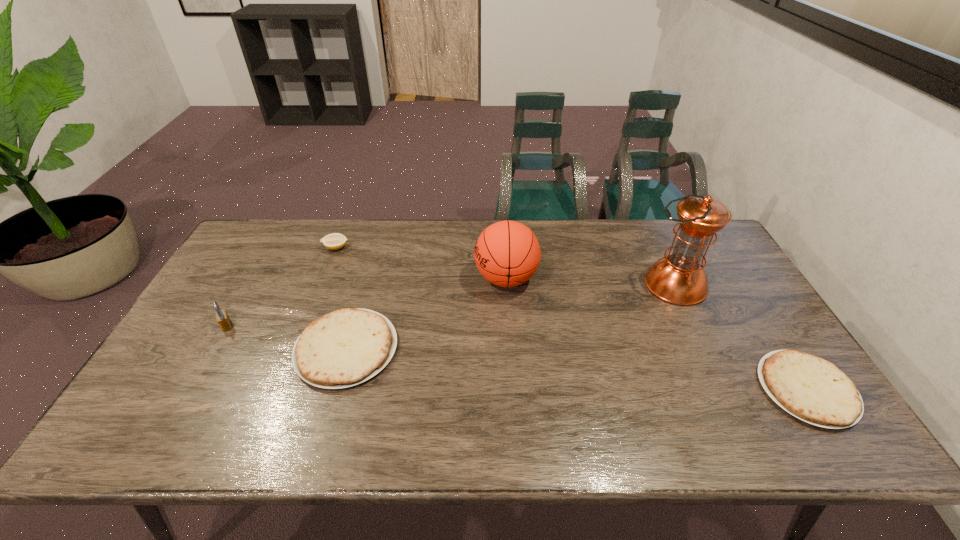
Identify the location of the left tortilla. The height and width of the screenshot is (540, 960). (346, 347).

Find the location of a particular element. This screenshot has width=960, height=540. the shorter tortilla is located at coordinates (814, 390).

The image size is (960, 540). In order to click on the shortest object in this screenshot , I will do `click(814, 390)`.

Where is `lemon`? lemon is located at coordinates (334, 241).

Where is `oil lamp`? This screenshot has width=960, height=540. oil lamp is located at coordinates (679, 279).

Locate an element on the screen. The height and width of the screenshot is (540, 960). padlock is located at coordinates (222, 317).

This screenshot has height=540, width=960. What are the coordinates of `the third tallest object` in the screenshot? It's located at (222, 317).

Where is `the third object from right to left`? This screenshot has width=960, height=540. the third object from right to left is located at coordinates (507, 253).

You are a GUI agent. You are given a task and a screenshot of the screen. Output one action in this format:
    pyautogui.click(x=<x>, y=<y>)
    Task: Click on the basketball
    
    Given the screenshot: What is the action you would take?
    pyautogui.click(x=507, y=253)

Where is `free region located on the right of the taller tortilla`? The image size is (960, 540). free region located on the right of the taller tortilla is located at coordinates click(x=517, y=349).